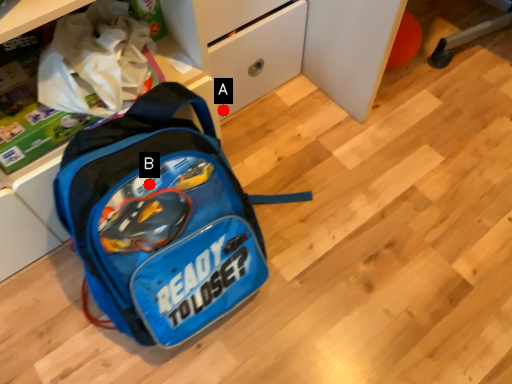
Question: Two points are circled on the image, labeled by A and B beside each circle. Which point is closer to the camera?

Choices:
 (A) A is closer
 (B) B is closer

Answer: (B)